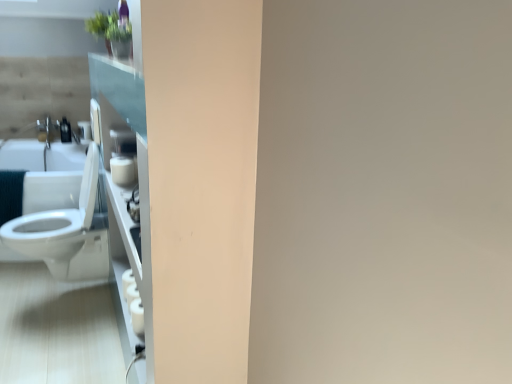
Question: From the image's perspective, is white glossy sink at left below white glossy toilet at left?

Choices:
 (A) no
 (B) yes

Answer: (A)

Question: Is white glossy toilet at left located within white glossy sink at left?

Choices:
 (A) yes
 (B) no

Answer: (B)

Question: Is the position of white glossy sink at left more distant than that of white glossy toilet at left?

Choices:
 (A) no
 (B) yes

Answer: (B)

Question: Does white glossy sink at left have a lesser height compared to white glossy toilet at left?

Choices:
 (A) yes
 (B) no

Answer: (A)

Question: Does white glossy sink at left lie in front of white glossy toilet at left?

Choices:
 (A) yes
 (B) no

Answer: (B)

Question: Is white glossy sink at left facing away from white glossy toilet at left?

Choices:
 (A) yes
 (B) no

Answer: (A)

Question: Is white matte toilet paper at lower left further to the viewer compared to white glossy sink at left?

Choices:
 (A) yes
 (B) no

Answer: (B)

Question: Are white matte toilet paper at lower left and white glossy sink at left located far from each other?

Choices:
 (A) no
 (B) yes

Answer: (B)

Question: Is white matte toilet paper at lower left positioned before white glossy sink at left?

Choices:
 (A) no
 (B) yes

Answer: (B)

Question: Does white matte toilet paper at lower left have a greater height compared to white glossy sink at left?

Choices:
 (A) yes
 (B) no

Answer: (B)

Question: Can you confirm if white matte toilet paper at lower left is bigger than white glossy sink at left?

Choices:
 (A) yes
 (B) no

Answer: (B)

Question: Can you confirm if white matte toilet paper at lower left is smaller than white glossy sink at left?

Choices:
 (A) no
 (B) yes

Answer: (B)

Question: Is white glossy toilet at left to the right of matte white soap dispenser at left from the viewer's perspective?

Choices:
 (A) yes
 (B) no

Answer: (A)